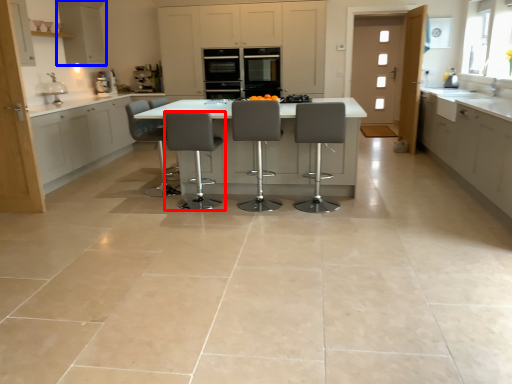
Question: Among these objects, which one is farthest to the camera, chair (highlighted by a red box) or cabinetry (highlighted by a blue box)?

Choices:
 (A) chair
 (B) cabinetry

Answer: (B)